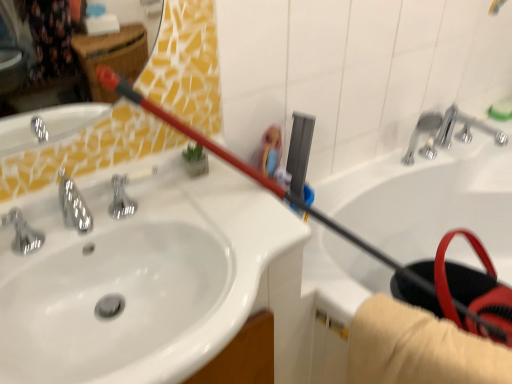
Question: From the image's perspective, is silver metallic faucet at upper right, the first plumbing fixture from the right, located beneath white glossy sink at upper left?

Choices:
 (A) no
 (B) yes

Answer: (A)

Question: From a real-world perspective, is silver metallic faucet at upper right, the second plumbing fixture from the left, beneath white glossy sink at upper left?

Choices:
 (A) yes
 (B) no

Answer: (B)

Question: Does silver metallic faucet at upper right, the second plumbing fixture from the left, come in front of white glossy sink at upper left?

Choices:
 (A) yes
 (B) no

Answer: (B)

Question: Is silver metallic faucet at upper right, the first plumbing fixture from the right, at the left side of white glossy sink at upper left?

Choices:
 (A) no
 (B) yes

Answer: (A)

Question: Is silver metallic faucet at upper right, the second plumbing fixture from the left, facing away from white glossy sink at upper left?

Choices:
 (A) no
 (B) yes

Answer: (A)

Question: From the image's perspective, is silver metallic faucet at upper right, the second plumbing fixture from the left, located above or below white glossy bathtub at upper right?

Choices:
 (A) above
 (B) below

Answer: (A)

Question: Considering the positions of silver metallic faucet at upper right, the second plumbing fixture from the left, and white glossy bathtub at upper right in the image, is silver metallic faucet at upper right, the second plumbing fixture from the left, wider or thinner than white glossy bathtub at upper right?

Choices:
 (A) wide
 (B) thin

Answer: (B)

Question: Choose the correct answer: Is silver metallic faucet at upper right, the second plumbing fixture from the left, inside white glossy bathtub at upper right or outside it?

Choices:
 (A) inside
 (B) outside

Answer: (A)

Question: Would you say silver metallic faucet at upper right, the first plumbing fixture from the right, is to the left or to the right of white glossy bathtub at upper right in the picture?

Choices:
 (A) left
 (B) right

Answer: (A)

Question: In terms of width, does silver metallic faucet at left look wider or thinner when compared to white glossy bathtub at upper right?

Choices:
 (A) wide
 (B) thin

Answer: (B)

Question: Visually, is silver metallic faucet at left positioned to the left or to the right of white glossy bathtub at upper right?

Choices:
 (A) left
 (B) right

Answer: (A)

Question: Choose the correct answer: Is silver metallic faucet at left inside white glossy bathtub at upper right or outside it?

Choices:
 (A) inside
 (B) outside

Answer: (B)

Question: From a real-world perspective, is silver metallic faucet at left physically located above or below white glossy bathtub at upper right?

Choices:
 (A) below
 (B) above

Answer: (B)

Question: From their relative heights in the image, would you say silver metallic faucet at upper right, the second plumbing fixture from the left, is taller or shorter than silver metallic faucet at left?

Choices:
 (A) short
 (B) tall

Answer: (B)

Question: From the image's perspective, is silver metallic faucet at upper right, the first plumbing fixture from the right, positioned above or below silver metallic faucet at left?

Choices:
 (A) below
 (B) above

Answer: (B)